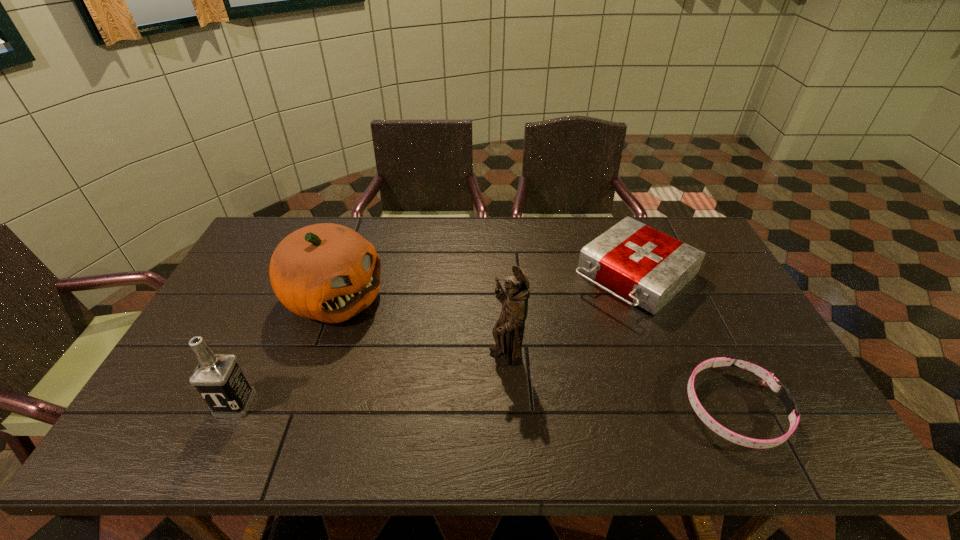
The height and width of the screenshot is (540, 960). I want to click on blank area located on the face of the pumpkin, so click(475, 370).

Locate an element on the screen. vacant space located on the face of the pumpkin is located at coordinates (389, 326).

Identify the location of free space located on the face of the pumpkin. (482, 373).

I want to click on vacant space positioned 0.120m on the front-facing side of the figurine, so click(x=465, y=399).

This screenshot has height=540, width=960. Find the location of `free spot located 0.130m on the front-facing side of the figurine`. free spot located 0.130m on the front-facing side of the figurine is located at coordinates (462, 402).

Where is `object present at the far edge`? Image resolution: width=960 pixels, height=540 pixels. object present at the far edge is located at coordinates (648, 267).

Find the location of a particular element. vodka situated at the near edge is located at coordinates (218, 378).

Locate an element on the screen. dog collar that is at the near edge is located at coordinates (768, 379).

Locate an element on the screen. object at the left edge is located at coordinates (218, 378).

Where is `dog collar at the right edge`? dog collar at the right edge is located at coordinates (768, 379).